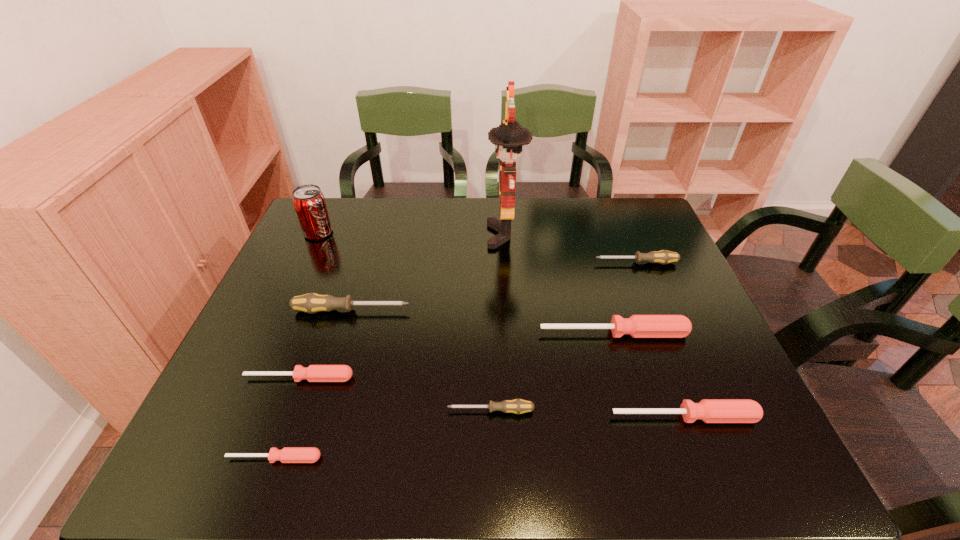
What are the coordinates of `the second closest red screwdriver to the nearest object` in the screenshot? It's located at (638, 326).

Where is `free space in the image that satisfies the following two spatial constraints: 1. on the back side of the fifth farthest object; 2. on the front-facing side of the tallest object`? The width and height of the screenshot is (960, 540). free space in the image that satisfies the following two spatial constraints: 1. on the back side of the fifth farthest object; 2. on the front-facing side of the tallest object is located at coordinates (585, 235).

I want to click on vacant point that satisfies the following two spatial constraints: 1. at the tip of the rightmost gray screwdriver; 2. on the front side of the second smallest red screwdriver, so click(x=683, y=378).